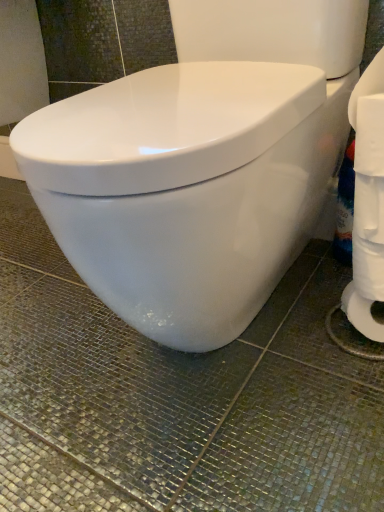
Identify the location of white glossy toilet at center. (187, 188).

The height and width of the screenshot is (512, 384). What do you see at coordinates (187, 188) in the screenshot?
I see `white glossy toilet at center` at bounding box center [187, 188].

This screenshot has height=512, width=384. Find the location of `white glossy toilet at center`. white glossy toilet at center is located at coordinates click(187, 188).